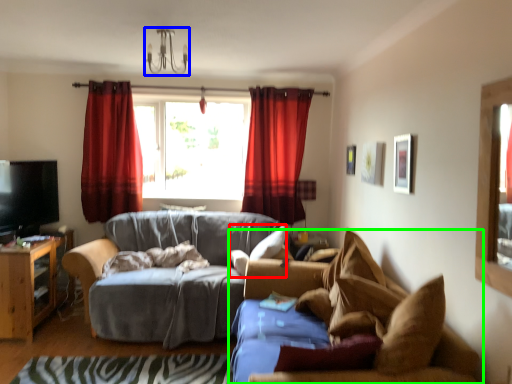
Question: Which object is the farthest from pillow (highlighted by a red box)? Choose among these: light fixture (highlighted by a blue box) or studio couch (highlighted by a green box).

Choices:
 (A) light fixture
 (B) studio couch

Answer: (A)